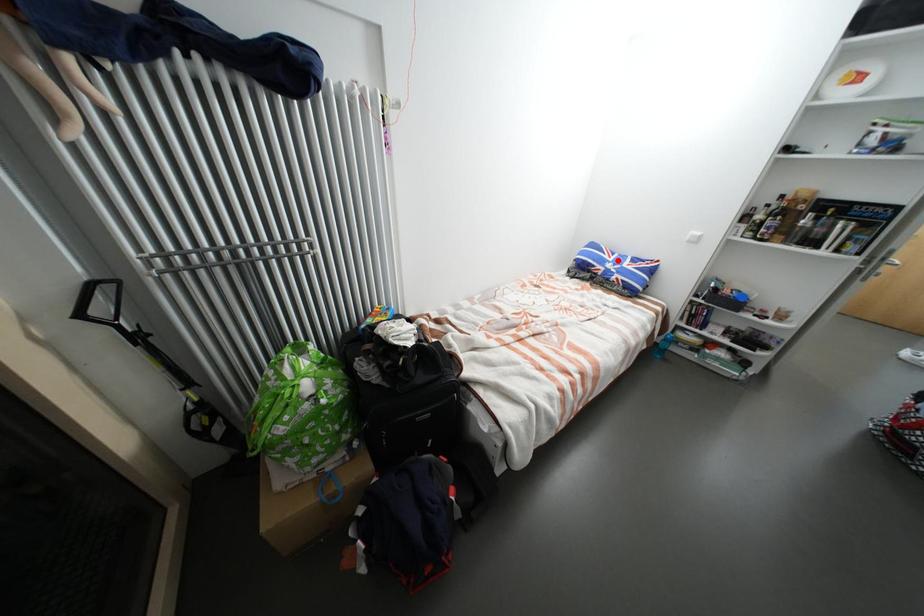
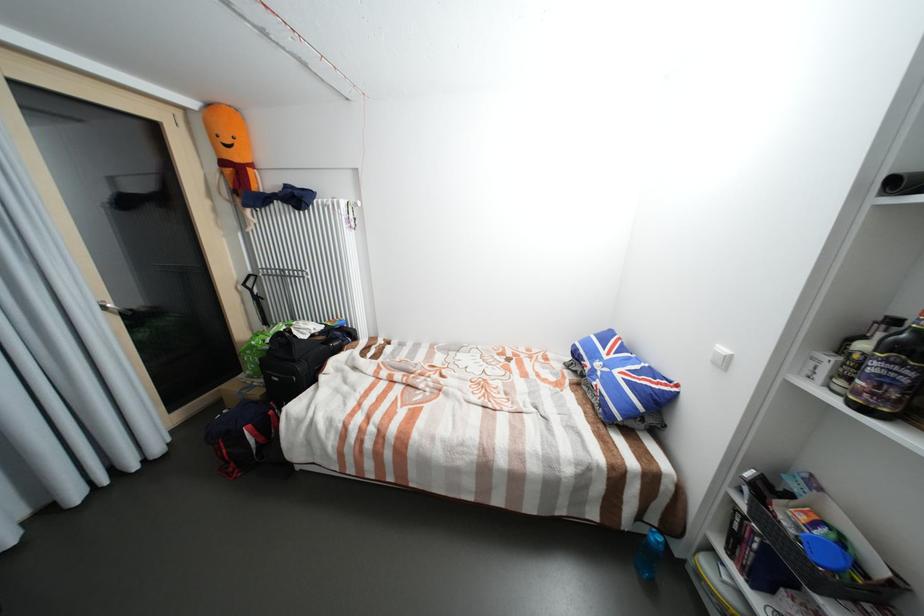
Find the pixel in the second image that matches the highlighted location in the first image.

(613, 358)